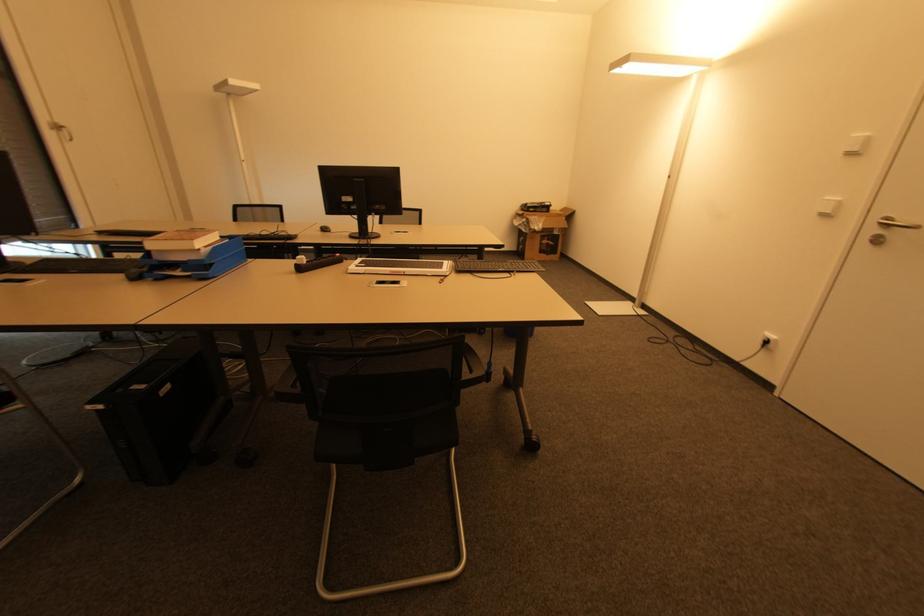
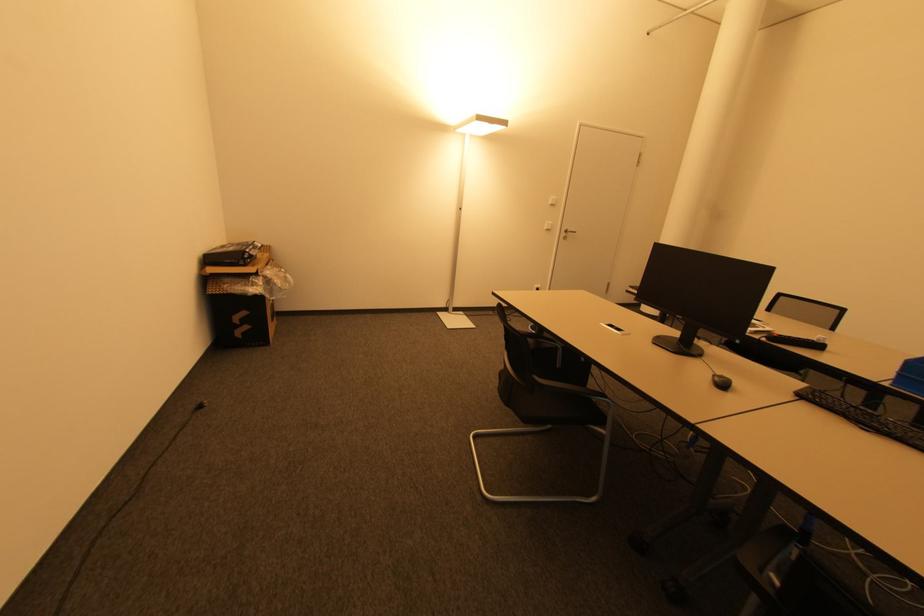
Where in the second image is the point corresponding to (x=325, y=230) from the first image?

(725, 386)